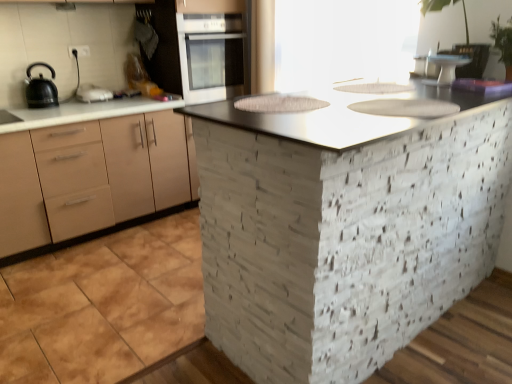
The width and height of the screenshot is (512, 384). What are the coordinates of `vacant space to the left of metallic gray countertop at center` in the screenshot? It's located at (132, 299).